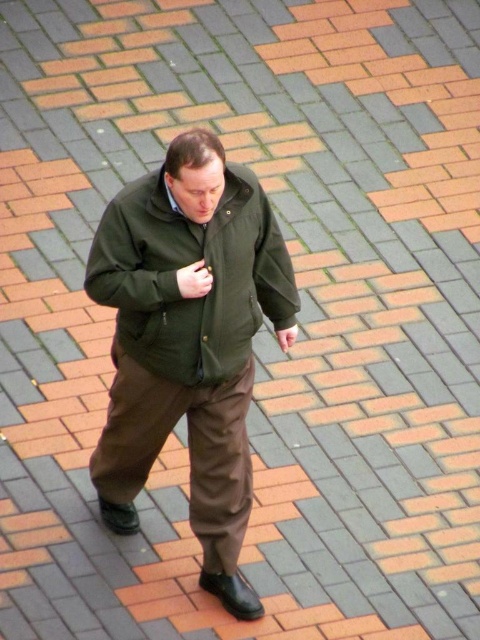
Is point (212, 221) positioned behind point (254, 320)?

That is False.

Is olive green fabric jacket at center below matte green pocket at center?

A: Actually, olive green fabric jacket at center is above matte green pocket at center.

Does point (149, 176) come farther from viewer compared to point (251, 307)?

No, (149, 176) is closer to viewer.

The image size is (480, 640). What are the coordinates of `olive green fabric jacket at center` in the screenshot? It's located at (186, 266).

Does point (214, 365) come behind point (160, 381)?

No, (214, 365) is in front of (160, 381).

Is olive green fabric jacket at center thinner than matte khaki pants at center?

In fact, olive green fabric jacket at center might be wider than matte khaki pants at center.

Locate an element on the screen. olive green fabric jacket at center is located at coordinates (186, 266).

What do you see at coordinates (189, 340) in the screenshot?
I see `green matte jacket at center` at bounding box center [189, 340].

Who is more forward, (124, 260) or (278, 228)?

Point (124, 260)

Who is more distant from viewer, (165,369) or (140,308)?

The point (165,369) is more distant.

Locate an element on the screen. This screenshot has width=480, height=640. green matte jacket at center is located at coordinates (189, 340).